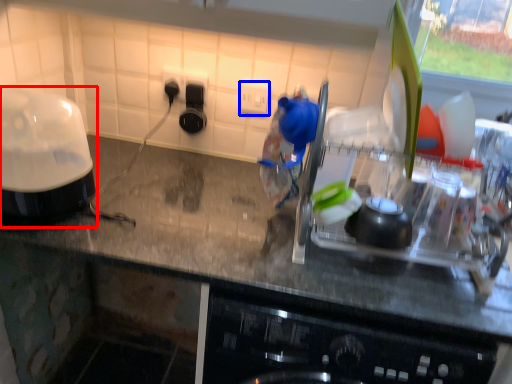
Question: Which of the following is the closest to the observer, home appliance (highlighted by a red box) or electric outlet (highlighted by a blue box)?

Choices:
 (A) home appliance
 (B) electric outlet

Answer: (A)